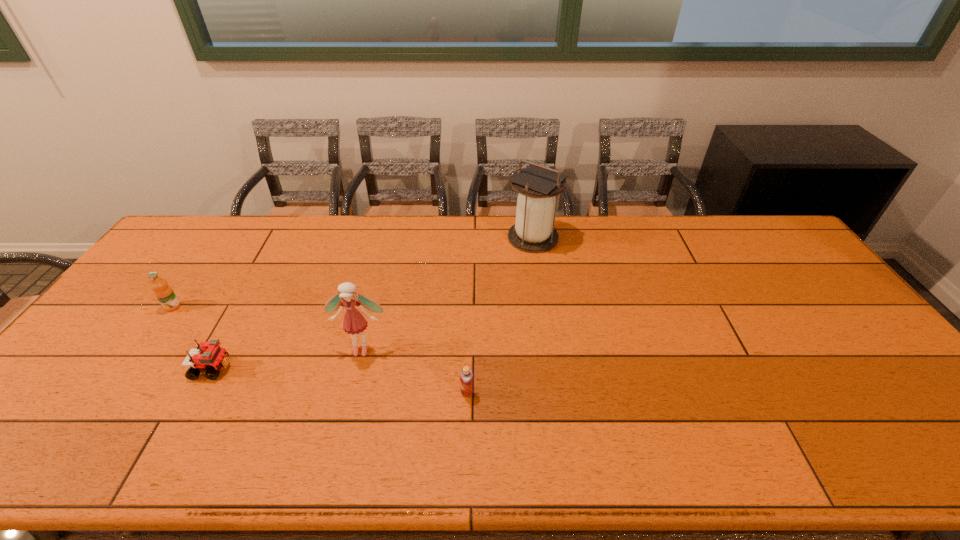
At what (x,y) coordinates should I click in order to perform the action: click on free spot at the far left corner of the desktop. Please return your answer as a coordinate pair (x, y). Looking at the image, I should click on (191, 238).

Where is `free point at the far right corner`? The width and height of the screenshot is (960, 540). free point at the far right corner is located at coordinates (780, 248).

Find the location of `blank region between the fourth object from left to right and the third object from left to right`. blank region between the fourth object from left to right and the third object from left to right is located at coordinates (415, 370).

This screenshot has height=540, width=960. Identify the location of vacant space that's between the Lego and the doll. (287, 359).

I want to click on unoccupied position between the fourth object from right to left and the doll, so click(287, 359).

Image resolution: width=960 pixels, height=540 pixels. I want to click on vacant area between the fourth object from right to left and the right orange juice, so click(x=340, y=381).

The image size is (960, 540). What are the coordinates of `free spot between the right orange juice and the second tallest object` in the screenshot? It's located at (415, 370).

You are a GUI agent. You are given a task and a screenshot of the screen. Output one action in this format:
    pyautogui.click(x=<x>, y=<y>)
    Task: Click on the vacant area that lies between the fourth object from right to left and the second object from right to left
    The width and height of the screenshot is (960, 540).
    Given the screenshot: What is the action you would take?
    pyautogui.click(x=340, y=381)

Find the location of a particular element. The height and width of the screenshot is (540, 960). free spot between the farther orange juice and the shorter orange juice is located at coordinates (320, 350).

Find the location of `the third closest object to the doll`. the third closest object to the doll is located at coordinates (533, 232).